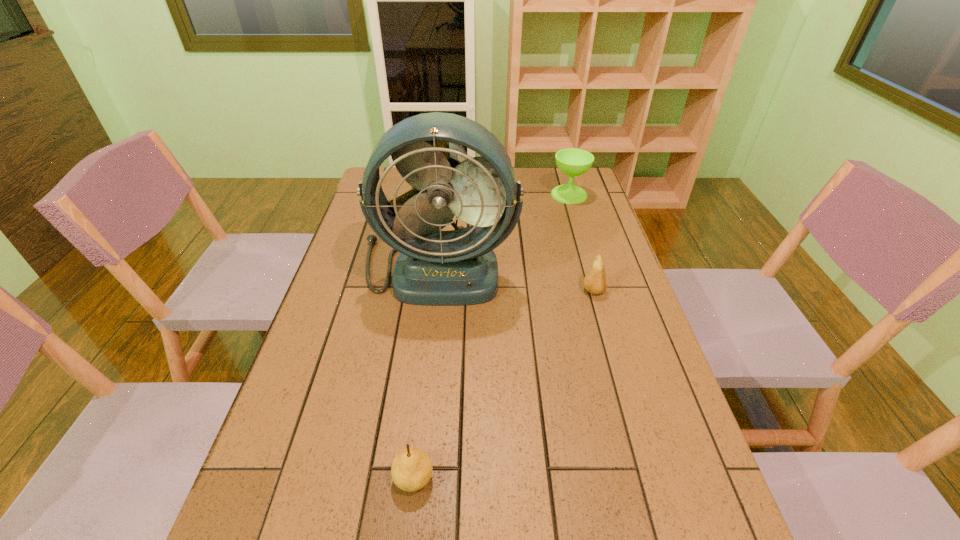
In order to click on vacant space that satisfies the following two spatial constraints: 1. in front of the fan to blow air; 2. on the right side of the right pear in this screenshot , I will do `click(436, 291)`.